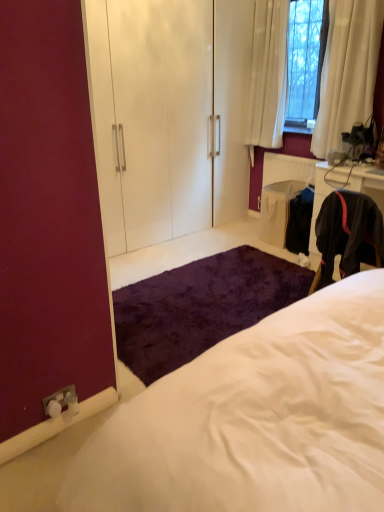
The height and width of the screenshot is (512, 384). Identify the location of blank space situated above shaggy purple rug at lower center (from a real-world perspective). (207, 297).